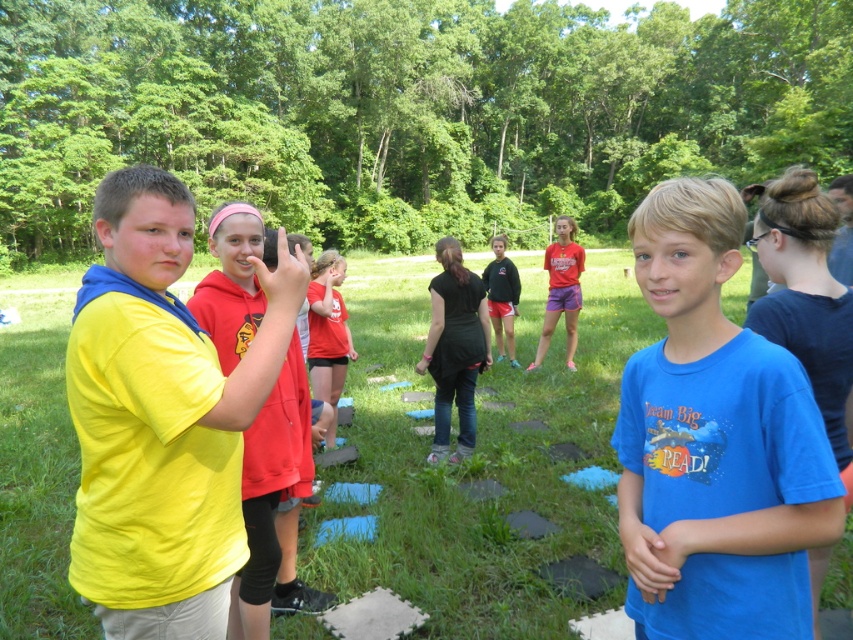
Based on the photo, who is higher up, green grass at center or matte red shorts at center?

matte red shorts at center is above.

Which is in front, point (566, 532) or point (541, 352)?

Point (566, 532) is in front.

Image resolution: width=853 pixels, height=640 pixels. I want to click on green grass at center, so (479, 464).

Is black matte shirt at center smaller than matte red shorts at center?

Actually, black matte shirt at center might be larger than matte red shorts at center.

The image size is (853, 640). What do you see at coordinates (454, 348) in the screenshot? I see `black matte shirt at center` at bounding box center [454, 348].

Identify the location of black matte shirt at center. (454, 348).

Which of these two, black matte shirt at center or black hoodie at center, stands shorter?

black hoodie at center is shorter.

Does black matte shirt at center come in front of black hoodie at center?

Yes, black matte shirt at center is in front of black hoodie at center.

Between point (471, 426) and point (491, 248), which one is positioned behind?

The point (491, 248) is more distant.

You are a GUI agent. You are given a task and a screenshot of the screen. Output one action in this format:
    pyautogui.click(x=<x>, y=<y>)
    Task: Click on the black matte shirt at center
    Image resolution: width=853 pixels, height=640 pixels.
    Given the screenshot: What is the action you would take?
    [x=454, y=348]